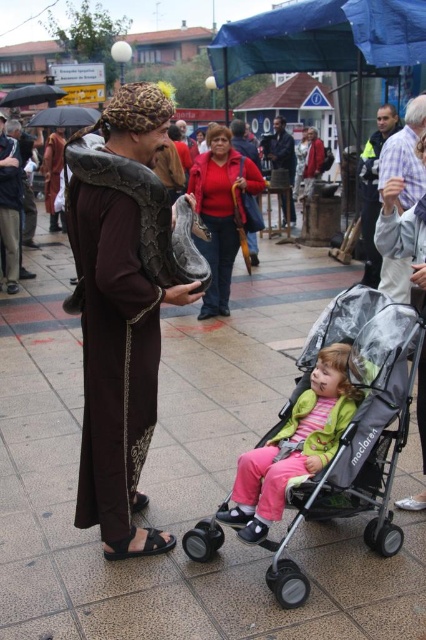
Is point (28, 404) behind point (423, 202)?

That is True.

Does brown tile pavement at center have a lesser height compared to matte gray stroller at lower right?

Yes.

Which is behind, point (66, 323) or point (382, 211)?

Point (66, 323)

Identify the location of brown tile pavement at center. 180,476.

Between matte brown robe at center and blue tarpaulin at upper center, which one has more height?

Standing taller between the two is matte brown robe at center.

Which of these two, matte brown robe at center or blue tarpaulin at upper center, stands shorter?

With less height is blue tarpaulin at upper center.

Where is `matte brown robe at center`? This screenshot has width=426, height=640. matte brown robe at center is located at coordinates (120, 307).

Who is positioned more to the left, gray fabric baby carriage at lower center or matte gray stroller at lower right?

Positioned to the left is gray fabric baby carriage at lower center.

Does point (374, 406) lie behind point (383, 196)?

That is False.

Locate an element on the screen. gray fabric baby carriage at lower center is located at coordinates (353, 428).